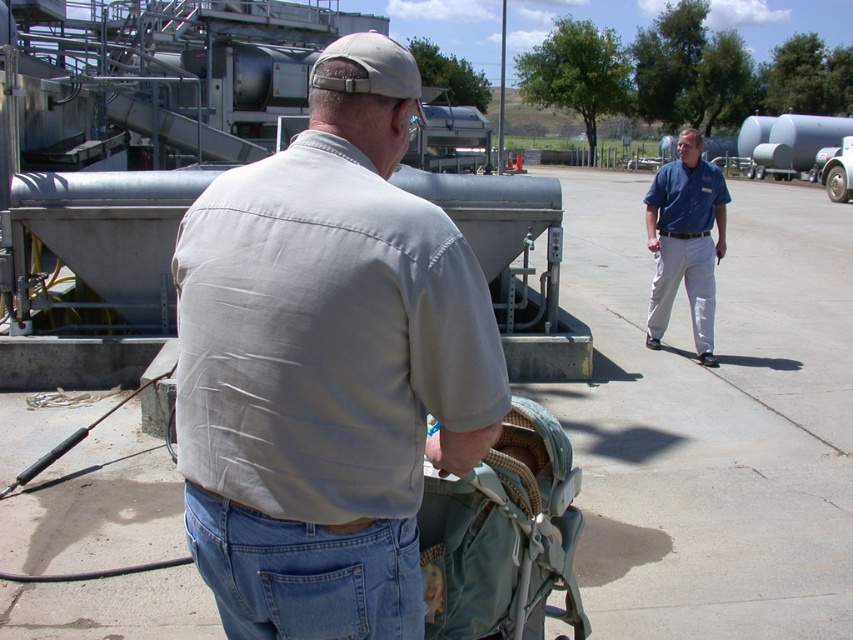
Which of these two, denim at center or blue cotton shirt at center, stands shorter?

denim at center

Does denim at center appear on the right side of blue cotton shirt at center?

Incorrect, denim at center is not on the right side of blue cotton shirt at center.

Image resolution: width=853 pixels, height=640 pixels. I want to click on denim at center, so click(305, 573).

This screenshot has height=640, width=853. I want to click on denim at center, so click(305, 573).

Measure the distance from light gray cotton shirt at center to blue cotton shirt at center.

6.00 meters

Which is below, light gray cotton shirt at center or blue cotton shirt at center?

light gray cotton shirt at center is below.

Who is more forward, (395, 252) or (660, 184)?

Point (395, 252)

Find the location of `light gray cotton shirt at center`. light gray cotton shirt at center is located at coordinates (328, 365).

Which is below, light gray cotton shirt at center or denim at center?

Positioned lower is denim at center.

Is light gray cotton shirt at center to the left of denim at center from the viewer's perspective?

No, light gray cotton shirt at center is not to the left of denim at center.

Between point (370, 129) and point (399, 579), which one is positioned behind?

The point (370, 129) is more distant.

Where is `light gray cotton shirt at center`? The image size is (853, 640). light gray cotton shirt at center is located at coordinates (328, 365).